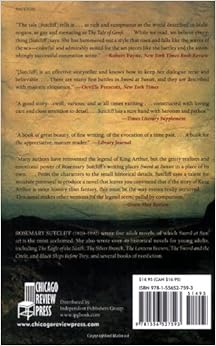
You are a GUI agent. You are given a task and a screenshot of the screen. Output one action in this format:
    pyautogui.click(x=<x>, y=<y>)
    Task: Click on the chair
    
    Given the screenshot: What is the action you would take?
    pyautogui.click(x=23, y=305)